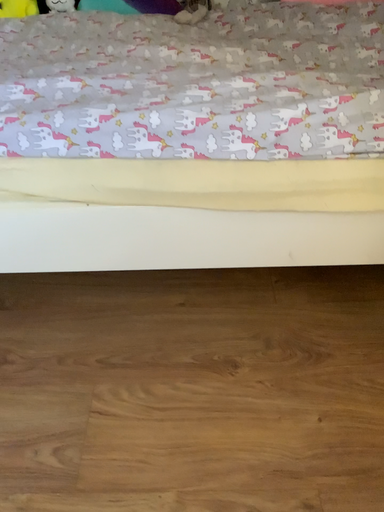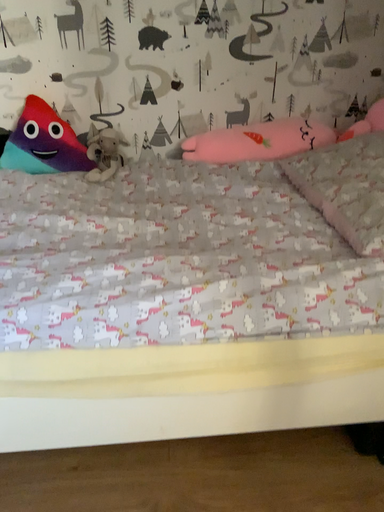
Question: Which way did the camera rotate in the video?

Choices:
 (A) rotated upward
 (B) rotated downward

Answer: (A)